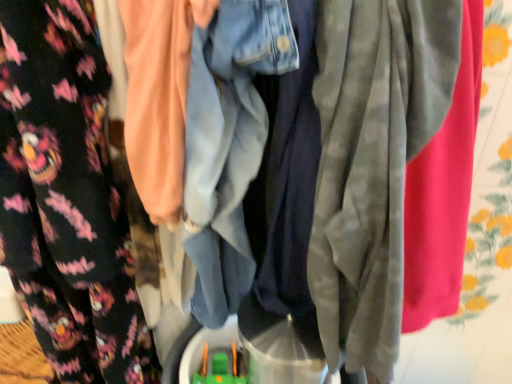
Question: Looking at their shapes, would you say floral fleece pants at left is wider or thinner than green plastic toy at center?

Choices:
 (A) wide
 (B) thin

Answer: (A)

Question: Is floral fleece pants at left inside or outside of green plastic toy at center?

Choices:
 (A) outside
 (B) inside

Answer: (A)

Question: Is point (100, 352) positioned closer to the camera than point (225, 377)?

Choices:
 (A) closer
 (B) farther

Answer: (A)

Question: Based on their positions, is green plastic toy at center located to the left or right of floral fleece pants at left?

Choices:
 (A) right
 (B) left

Answer: (A)

Question: Choose the correct answer: Is green plastic toy at center inside floral fleece pants at left or outside it?

Choices:
 (A) outside
 (B) inside

Answer: (A)

Question: Considering the positions of green plastic toy at center and floral fleece pants at left in the image, is green plastic toy at center bigger or smaller than floral fleece pants at left?

Choices:
 (A) small
 (B) big

Answer: (A)

Question: From a real-world perspective, is green plastic toy at center positioned above or below floral fleece pants at left?

Choices:
 (A) below
 (B) above

Answer: (A)